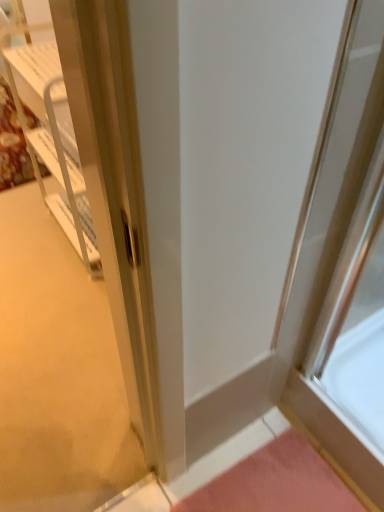
Question: Is pink fabric doormat at lower right shorter than white plastic cabinet at left?

Choices:
 (A) no
 (B) yes

Answer: (B)

Question: From a real-world perspective, is pink fabric doormat at lower right over white plastic cabinet at left?

Choices:
 (A) yes
 (B) no

Answer: (B)

Question: Is pink fabric doormat at lower right facing towards white plastic cabinet at left?

Choices:
 (A) no
 (B) yes

Answer: (A)

Question: Is pink fabric doormat at lower right to the right of white plastic cabinet at left from the viewer's perspective?

Choices:
 (A) no
 (B) yes

Answer: (B)

Question: Can you confirm if pink fabric doormat at lower right is thinner than white plastic cabinet at left?

Choices:
 (A) yes
 (B) no

Answer: (B)

Question: Is there a large distance between pink fabric doormat at lower right and white plastic cabinet at left?

Choices:
 (A) no
 (B) yes

Answer: (B)

Question: Is white plastic cabinet at left to the right of pink fabric doormat at lower right from the viewer's perspective?

Choices:
 (A) yes
 (B) no

Answer: (B)

Question: Does white plastic cabinet at left have a greater width compared to pink fabric doormat at lower right?

Choices:
 (A) no
 (B) yes

Answer: (A)

Question: Is white plastic cabinet at left thinner than pink fabric doormat at lower right?

Choices:
 (A) yes
 (B) no

Answer: (A)

Question: Are white plastic cabinet at left and pink fabric doormat at lower right located far from each other?

Choices:
 (A) yes
 (B) no

Answer: (A)

Question: Is white plastic cabinet at left positioned with its back to pink fabric doormat at lower right?

Choices:
 (A) no
 (B) yes

Answer: (A)

Question: Is the position of white plastic cabinet at left more distant than that of pink fabric doormat at lower right?

Choices:
 (A) no
 (B) yes

Answer: (B)

Question: From the image's perspective, is white plastic cabinet at left positioned above or below pink fabric doormat at lower right?

Choices:
 (A) below
 (B) above

Answer: (B)